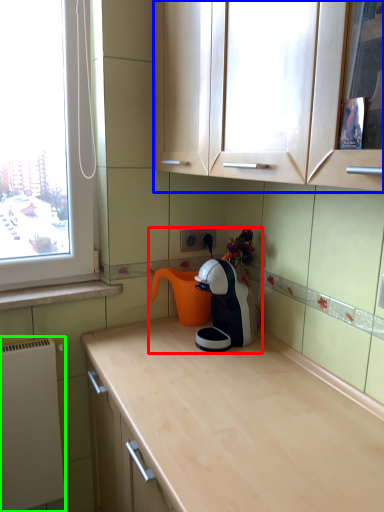
Question: Which object is positioned closest to tea set (highlighted by a red box)? Select from cabinetry (highlighted by a blue box) and appliance (highlighted by a green box).

Choices:
 (A) cabinetry
 (B) appliance

Answer: (A)